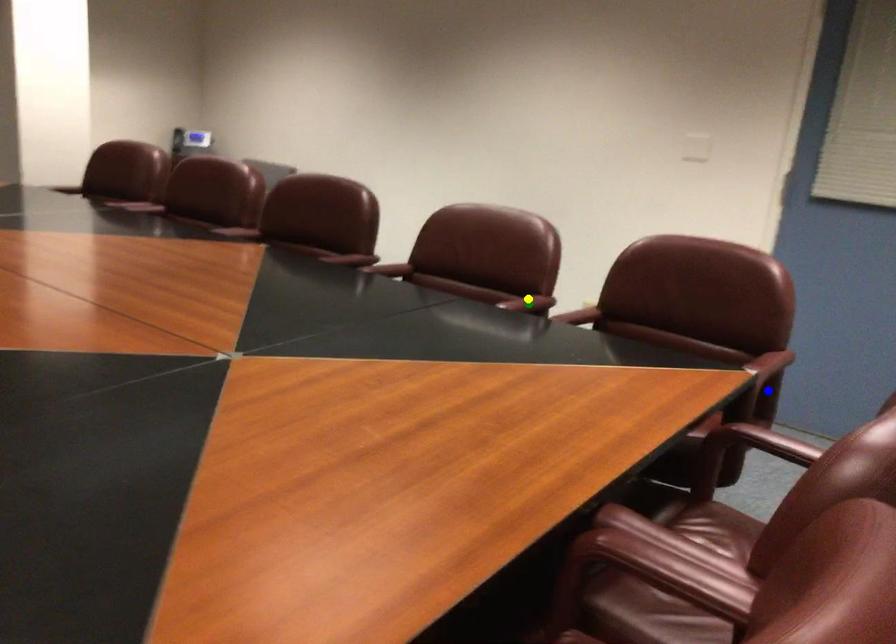
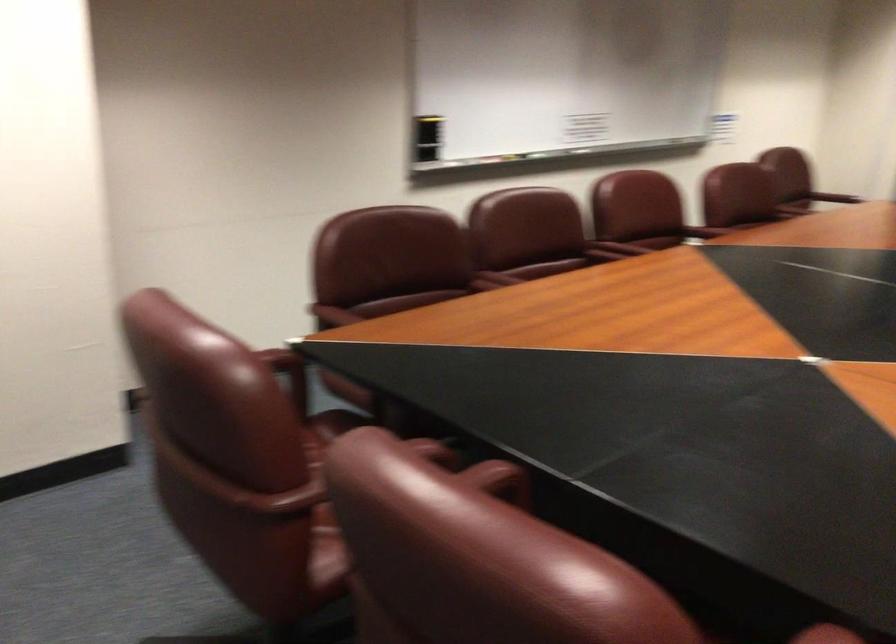
I am providing you with two images of the same scene from different viewpoints. Three points are marked in image1. Which point corresponds to a part or object that is occluded in image2?In image1, three points are marked. Which of them correspond to a part or object that is occluded in image2?Among the three points shown in image1, which one corresponds to a part or object that is no longer visible due to occlusion in image2?

green point